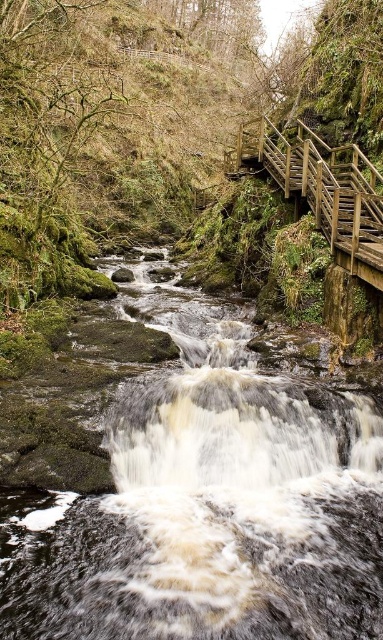
Question: Which object is the closest to the dark gray stone stream at center?

Choices:
 (A) wooden stairs at upper center
 (B) green mossy rock at center

Answer: (A)

Question: Is dark gray stone stream at center smaller than green mossy rock at center?

Choices:
 (A) no
 (B) yes

Answer: (A)

Question: Does dark gray stone stream at center have a lesser width compared to green mossy rock at center?

Choices:
 (A) yes
 (B) no

Answer: (B)

Question: Estimate the real-world distances between objects in this image. Which object is farther from the dark gray stone stream at center?

Choices:
 (A) green mossy rock at center
 (B) wooden stairs at upper center

Answer: (A)

Question: Is the position of dark gray stone stream at center less distant than that of wooden stairs at upper center?

Choices:
 (A) yes
 (B) no

Answer: (A)

Question: Which object is farther from the camera taking this photo?

Choices:
 (A) wooden stairs at upper center
 (B) dark gray stone stream at center

Answer: (A)